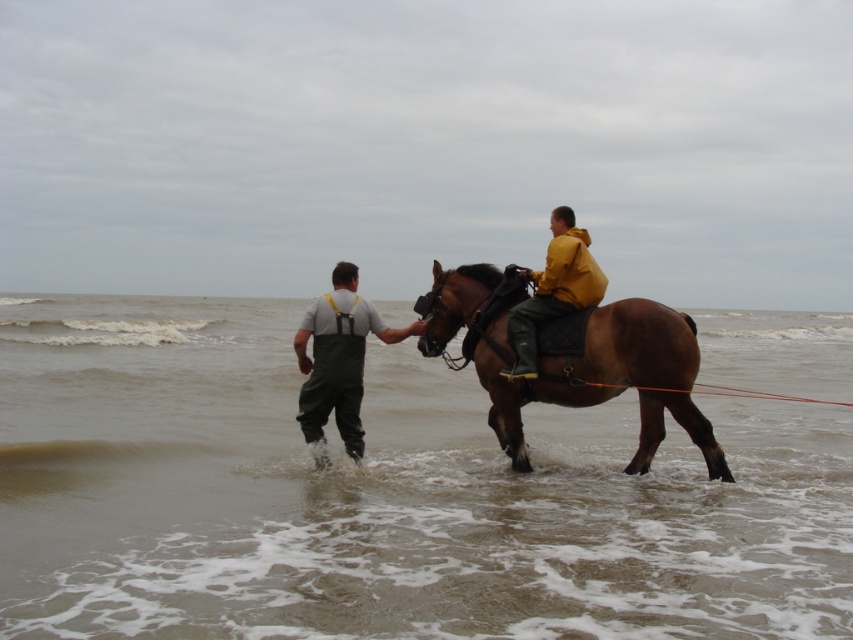
Question: Does brown wet sand at lower center have a lesser width compared to yellow matte jacket at center?

Choices:
 (A) yes
 (B) no

Answer: (B)

Question: Which point is closer to the camera taking this photo?

Choices:
 (A) 329,301
 (B) 556,488

Answer: (A)

Question: Can you confirm if gray rubber boots at center is bigger than yellow matte jacket at center?

Choices:
 (A) yes
 (B) no

Answer: (A)

Question: Which object is positioned farthest from the brown wet sand at lower center?

Choices:
 (A) yellow matte jacket at center
 (B) gray rubber boots at center
 (C) brown glossy horse at center

Answer: (A)

Question: Which object appears closest to the camera in this image?

Choices:
 (A) yellow matte jacket at center
 (B) brown wet sand at lower center

Answer: (B)

Question: Is brown glossy horse at center below yellow matte jacket at center?

Choices:
 (A) no
 (B) yes

Answer: (B)